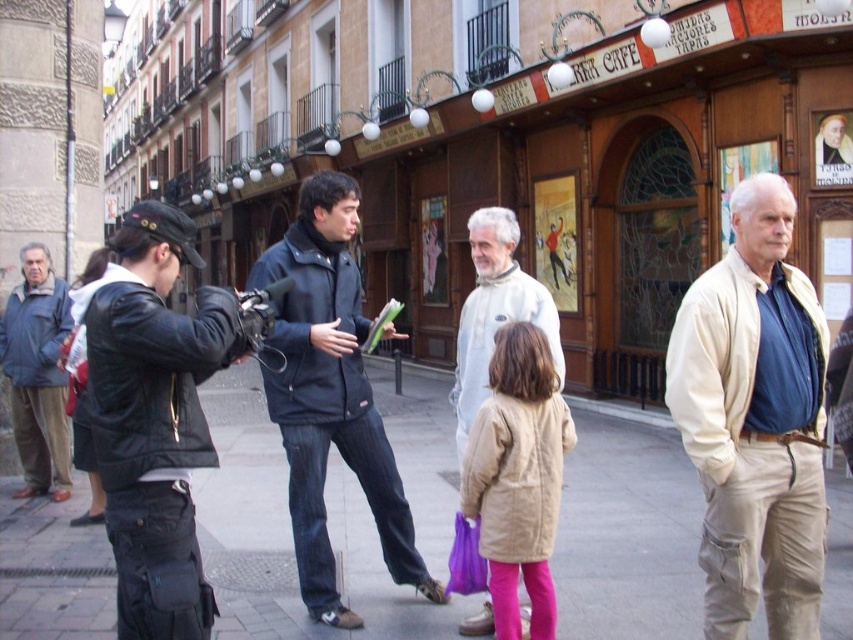
Is the position of dark blue jacket at center more distant than that of beige fabric coat at center?

Yes, dark blue jacket at center is further from the viewer.

Is dark blue jacket at center thinner than beige fabric coat at center?

No, dark blue jacket at center is not thinner than beige fabric coat at center.

Which is in front, point (312, 248) or point (532, 499)?

Point (532, 499) is in front.

This screenshot has height=640, width=853. Find the location of `dark blue jacket at center`. dark blue jacket at center is located at coordinates (329, 394).

Who is positioned more to the left, paved stone sidewalk at center or beige cotton jacket at right?

paved stone sidewalk at center

Does point (259, 627) come behind point (686, 365)?

Yes, point (259, 627) is farther from viewer.

Image resolution: width=853 pixels, height=640 pixels. I want to click on paved stone sidewalk at center, so click(x=289, y=532).

Can you confirm if black leather jacket at left is positioned above beige fabric coat at center?

Correct, black leather jacket at left is located above beige fabric coat at center.

Is point (125, 248) farther from viewer compared to point (538, 378)?

That is False.

You are a GUI agent. You are given a task and a screenshot of the screen. Output one action in this format:
    pyautogui.click(x=<x>, y=<y>)
    Task: Click on the black leather jacket at left
    The image size is (853, 640).
    Given the screenshot: What is the action you would take?
    pyautogui.click(x=154, y=416)

Where is `black leather jacket at left`? The width and height of the screenshot is (853, 640). black leather jacket at left is located at coordinates (154, 416).